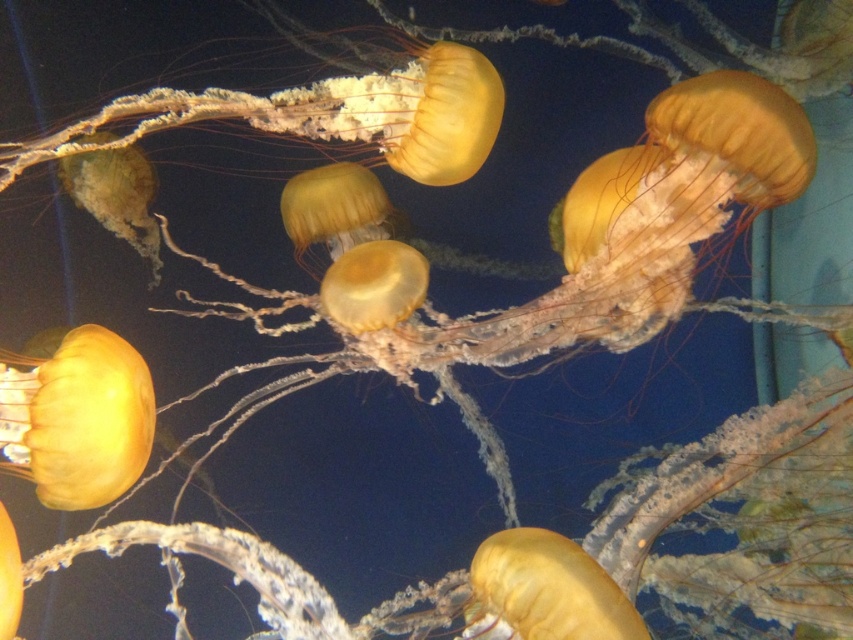
Based on the photo, does translucent yellow jellyfish at upper center have a greater width compared to translucent yellow jellyfish at bottom left?

Correct, the width of translucent yellow jellyfish at upper center exceeds that of translucent yellow jellyfish at bottom left.

Between point (119, 116) and point (13, 396), which one is positioned in front?

Point (13, 396) is more forward.

In order to click on translucent yellow jellyfish at upper center in this screenshot , I will do coord(326,115).

Which is behind, point (737, 140) or point (32, 452)?

The point (737, 140) is more distant.

Is translucent yellow jellyfish at center bigger than translucent yellow jellyfish at bottom left?

Indeed, translucent yellow jellyfish at center has a larger size compared to translucent yellow jellyfish at bottom left.

This screenshot has height=640, width=853. In order to click on translucent yellow jellyfish at center in this screenshot , I will do `click(593, 253)`.

Who is shorter, translucent yellow jellyfish at center or translucent yellow jellyfish at upper center?

Answer: translucent yellow jellyfish at upper center is shorter.

Is translucent yellow jellyfish at center positioned behind translucent yellow jellyfish at upper center?

Yes, it is behind translucent yellow jellyfish at upper center.

Between point (376, 352) and point (404, 138), which one is positioned behind?

Point (376, 352)

Locate an element on the screen. translucent yellow jellyfish at center is located at coordinates (593, 253).